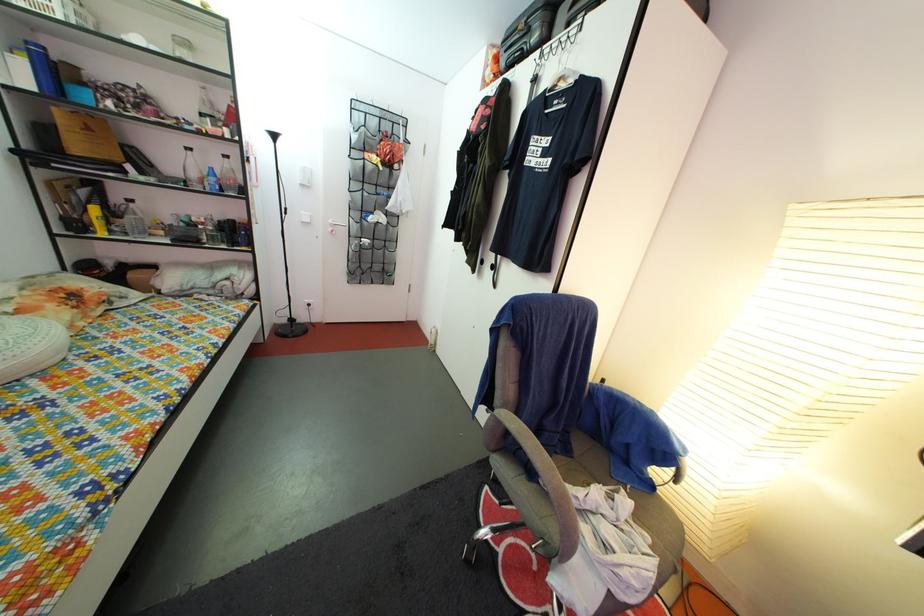
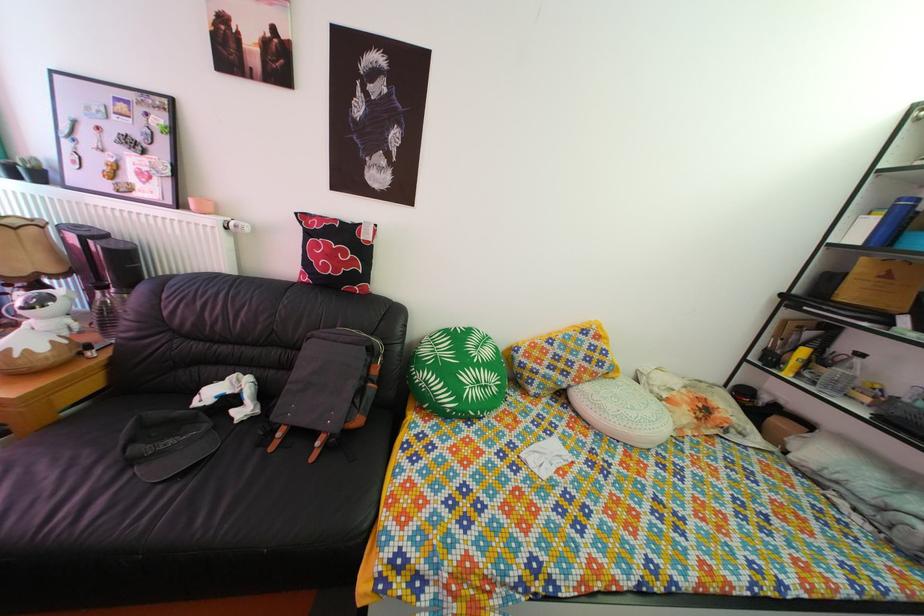
In the second image, find the point that corresponds to (102,233) in the first image.

(794, 371)